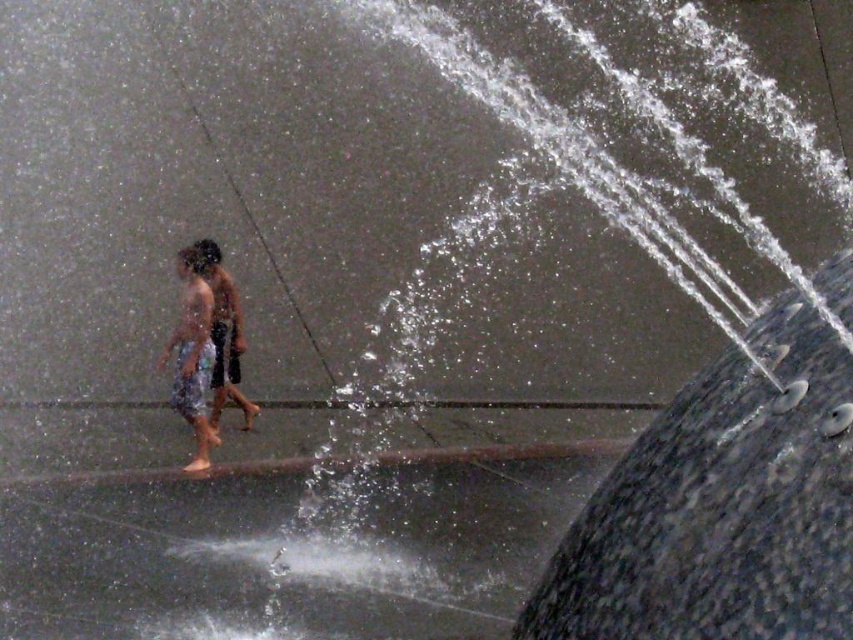
Question: Which point is farther from the camera taking this photo?

Choices:
 (A) (215, 292)
 (B) (206, 374)

Answer: (A)

Question: Can you confirm if white cotton shorts at left is bigger than shiny metallic shorts at center?

Choices:
 (A) no
 (B) yes

Answer: (B)

Question: Which of the following is the farthest from the observer?

Choices:
 (A) white cotton shorts at left
 (B) shiny metallic shorts at center

Answer: (B)

Question: Among these objects, which one is farthest from the camera?

Choices:
 (A) shiny metallic shorts at center
 (B) white cotton shorts at left

Answer: (A)

Question: Does white cotton shorts at left have a larger size compared to shiny metallic shorts at center?

Choices:
 (A) no
 (B) yes

Answer: (B)

Question: Is white cotton shorts at left bigger than shiny metallic shorts at center?

Choices:
 (A) yes
 (B) no

Answer: (A)